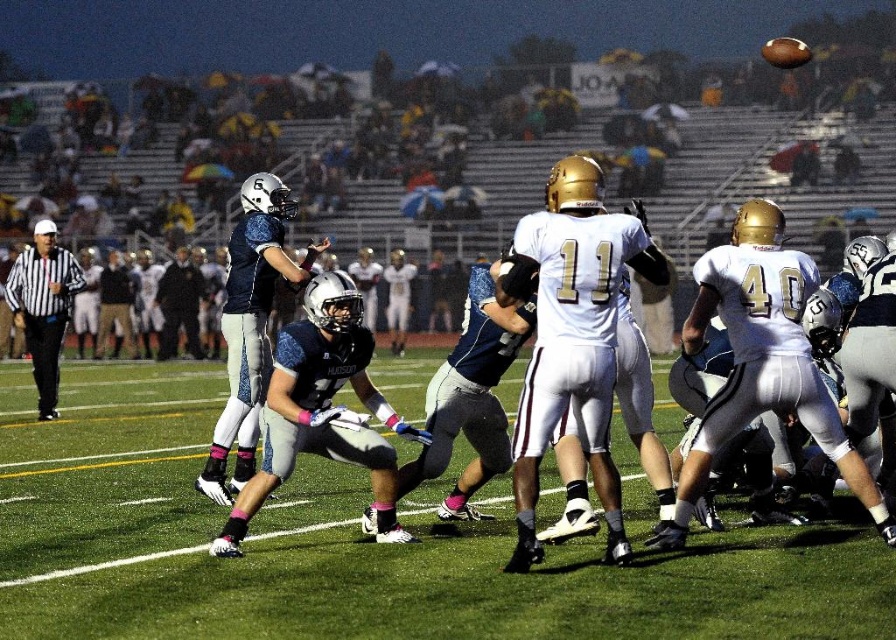
Question: Can you confirm if green grass football field at center is smaller than black striped shirt at left?

Choices:
 (A) no
 (B) yes

Answer: (A)

Question: Which point is closer to the camera taking this photo?

Choices:
 (A) (596, 563)
 (B) (59, 337)

Answer: (A)

Question: Which point appears closest to the camera in this image?

Choices:
 (A) (75, 577)
 (B) (39, 307)

Answer: (A)

Question: Where is green grass football field at center located in relation to black striped shirt at left in the image?

Choices:
 (A) below
 (B) above

Answer: (A)

Question: Which point is closer to the camera taking this photo?

Choices:
 (A) 14,308
 (B) 39,609

Answer: (B)

Question: Can you confirm if green grass football field at center is positioned to the right of black striped shirt at left?

Choices:
 (A) no
 (B) yes

Answer: (B)